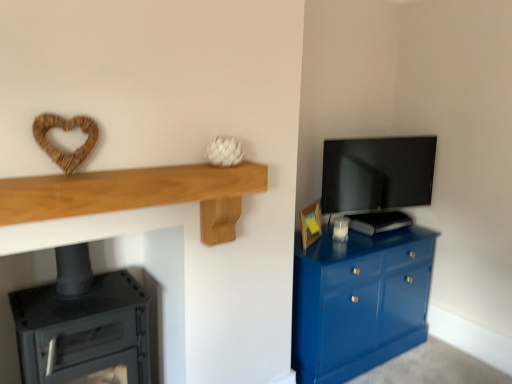
Question: Is glossy blue cabinet at right turned away from light oak wood shelf at upper left?

Choices:
 (A) yes
 (B) no

Answer: (B)

Question: Is glossy blue cabinet at right positioned behind light oak wood shelf at upper left?

Choices:
 (A) yes
 (B) no

Answer: (A)

Question: Is glossy blue cabinet at right positioned before light oak wood shelf at upper left?

Choices:
 (A) no
 (B) yes

Answer: (A)

Question: From the image's perspective, is glossy blue cabinet at right above light oak wood shelf at upper left?

Choices:
 (A) no
 (B) yes

Answer: (A)

Question: Does glossy blue cabinet at right appear on the left side of light oak wood shelf at upper left?

Choices:
 (A) yes
 (B) no

Answer: (B)

Question: Is light oak wood shelf at upper left located within glossy blue cabinet at right?

Choices:
 (A) yes
 (B) no

Answer: (B)

Question: Is wooden picture frame at right closer to camera compared to light oak wood shelf at upper left?

Choices:
 (A) yes
 (B) no

Answer: (B)

Question: Is wooden picture frame at right oriented towards light oak wood shelf at upper left?

Choices:
 (A) no
 (B) yes

Answer: (A)

Question: Does wooden picture frame at right have a lesser width compared to light oak wood shelf at upper left?

Choices:
 (A) yes
 (B) no

Answer: (A)

Question: Would you consider wooden picture frame at right to be distant from light oak wood shelf at upper left?

Choices:
 (A) yes
 (B) no

Answer: (A)

Question: Can you confirm if wooden picture frame at right is positioned to the right of light oak wood shelf at upper left?

Choices:
 (A) yes
 (B) no

Answer: (A)

Question: Considering the relative sizes of wooden picture frame at right and light oak wood shelf at upper left in the image provided, is wooden picture frame at right bigger than light oak wood shelf at upper left?

Choices:
 (A) no
 (B) yes

Answer: (A)

Question: Can you confirm if matte black tv at upper right is positioned to the right of black matte stove at lower left?

Choices:
 (A) yes
 (B) no

Answer: (A)